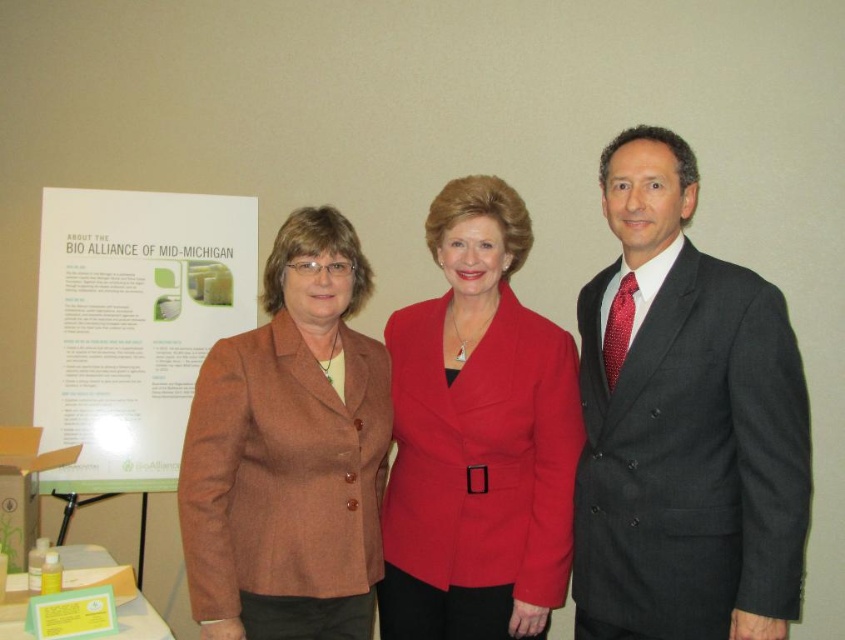
Question: Which object is closer to the camera taking this photo?

Choices:
 (A) dark gray suit at center
 (B) brown woolen blazer at center

Answer: (A)

Question: Which point is farther to the camera?

Choices:
 (A) matte red blazer at center
 (B) white paper at left
 (C) dark gray suit at center

Answer: (B)

Question: Which object is positioned farthest from the dark gray suit at center?

Choices:
 (A) brown woolen blazer at center
 (B) white paper at left

Answer: (B)

Question: In this image, where is brown woolen blazer at center located relative to white paper at left?

Choices:
 (A) left
 (B) right

Answer: (B)

Question: Can you confirm if dark gray suit at center is positioned below matte red blazer at center?

Choices:
 (A) yes
 (B) no

Answer: (B)

Question: Is the position of matte red blazer at center less distant than that of brown woolen blazer at center?

Choices:
 (A) yes
 (B) no

Answer: (B)